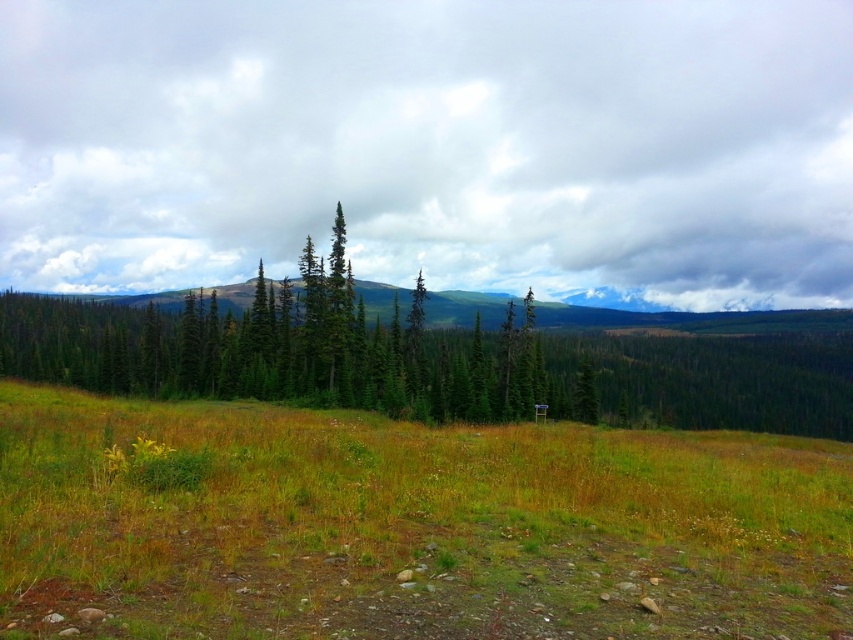
Who is more distant from viewer, (579, 588) or (343, 284)?

Point (343, 284)

Who is positioned more to the right, green grassy field at lower center or green matte tree at center?

green grassy field at lower center

Is point (619, 452) in front of point (334, 342)?

That is True.

Where is `green grassy field at lower center`? Image resolution: width=853 pixels, height=640 pixels. green grassy field at lower center is located at coordinates (410, 525).